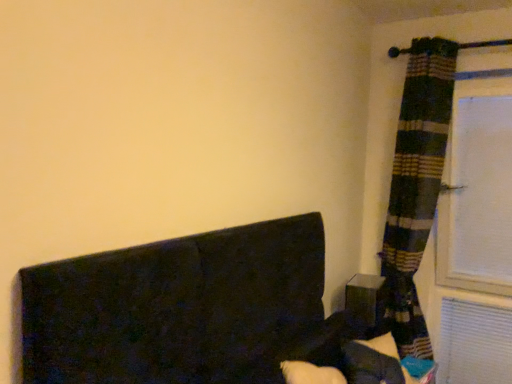
Where is `matte black cube at right`? The image size is (512, 384). matte black cube at right is located at coordinates (362, 297).

In order to face matte black cube at right, should I rotate leftwards or rightwards?

Rotate your view right by about 14.647°.

Measure the distance between matte black cube at right and camera.

matte black cube at right and camera are 1.93 meters apart.

Describe the element at coordinates (362, 297) in the screenshot. I see `matte black cube at right` at that location.

Find the location of a particular element. The image size is (512, 384). matte black cube at right is located at coordinates (362, 297).